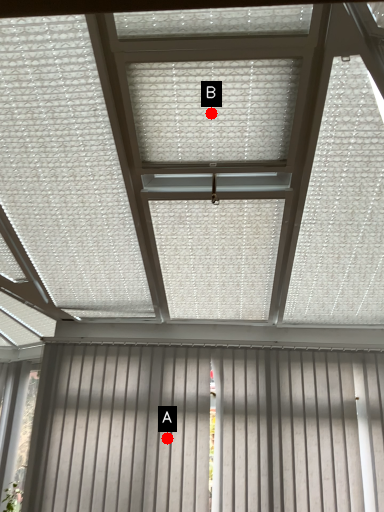
Question: Two points are circled on the image, labeled by A and B beside each circle. Which point is farther to the camera?

Choices:
 (A) A is further
 (B) B is further

Answer: (A)